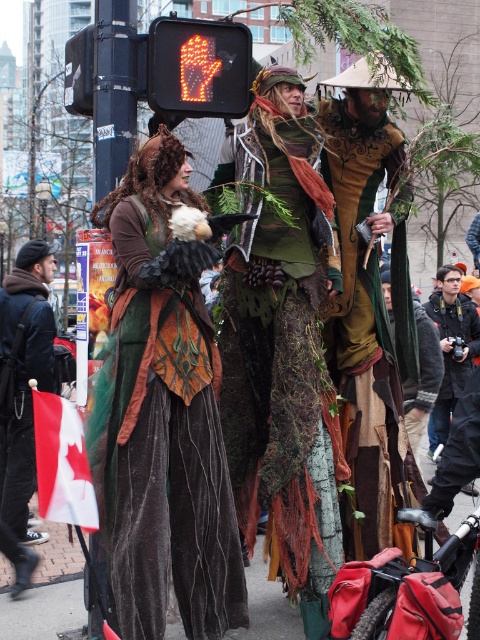
You are a photographer trying to capture the green velvet dress at center in your shot. Based on the coordinates provided, where should you position your camera to ensure the dress is centered in the frame?

The green velvet dress at center is located at coordinates point (368, 312), so positioning the camera to aim directly at those coordinates will center the dress in the frame.